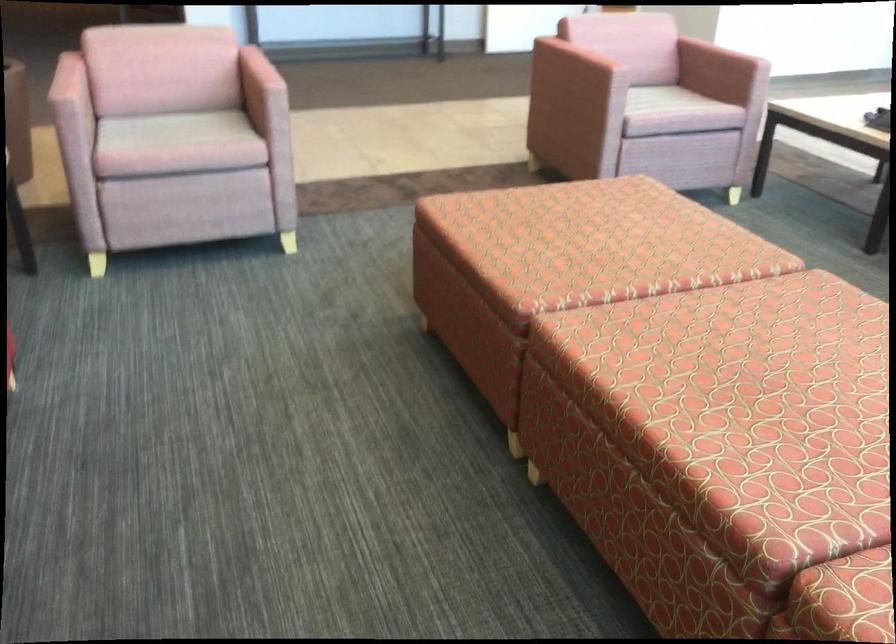
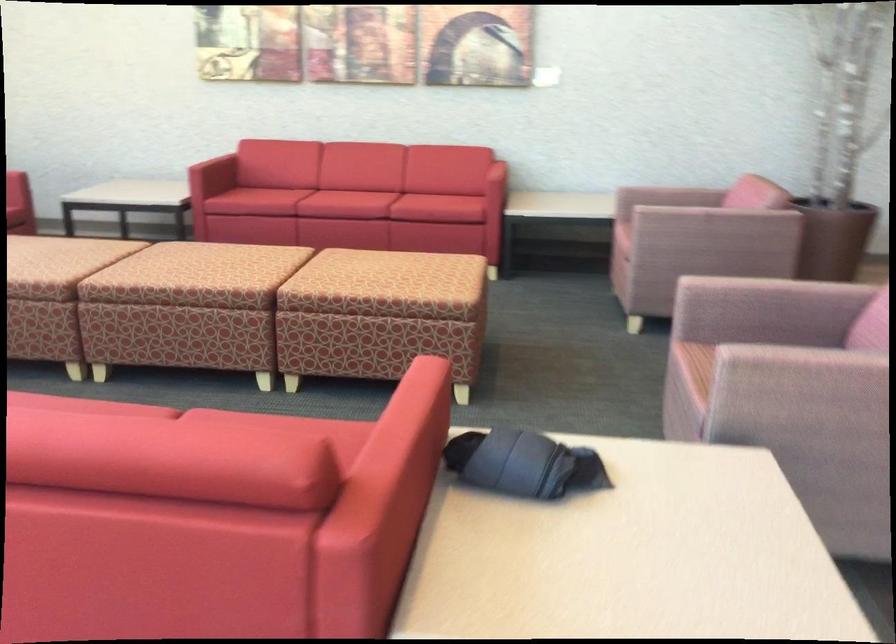
Locate, in the second image, the point that corresponds to point (607, 84) in the first image.

(760, 330)